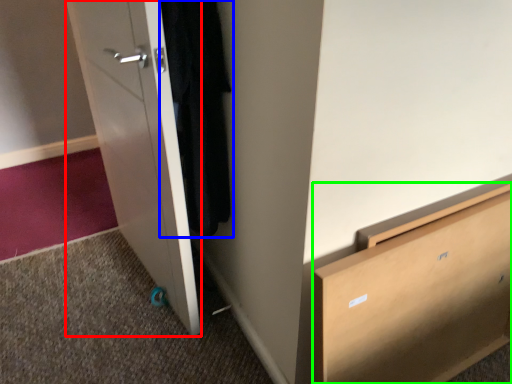
Question: Based on their relative distances, which object is nearer to door (highlighted by a red box)? Choose from clothing (highlighted by a blue box) and chest of drawers (highlighted by a green box).

Choices:
 (A) clothing
 (B) chest of drawers

Answer: (A)